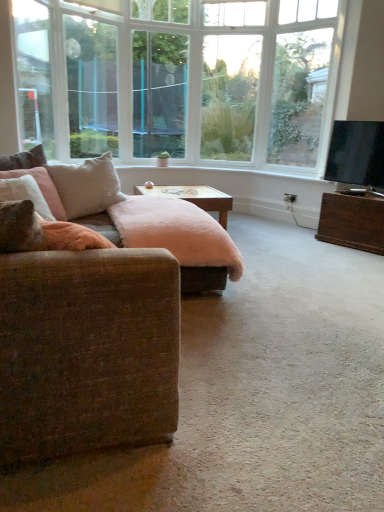
Question: Is clear glass window screen at center, marked as the 1th window screen in a right-to-left arrangement, bigger or smaller than clear glass window screen at upper left, the first window screen viewed from the left?

Choices:
 (A) big
 (B) small

Answer: (B)

Question: Relative to clear glass window screen at upper left, marked as the second window screen in a right-to-left arrangement, is clear glass window screen at center, marked as the 1th window screen in a right-to-left arrangement, in front or behind?

Choices:
 (A) behind
 (B) front

Answer: (A)

Question: Which object is the farthest from the woodenobject at center, the 2th table viewed from the right?

Choices:
 (A) white soft pillow at upper left, acting as the second pillow starting from the left
 (B) clear glass window screen at center, which ranks as the second window screen in left-to-right order
 (C) clear glass window screen at upper left, marked as the second window screen in a right-to-left arrangement
 (D) wooden coffee table at right, placed as the first table when sorted from right to left
 (E) velvet pink pillow at left, acting as the first pillow starting from the left

Answer: (B)

Question: Estimate the real-world distances between objects in this image. Which object is closer to the white soft pillow at upper left, the first pillow from the right?

Choices:
 (A) clear glass window screen at center, which ranks as the second window screen in left-to-right order
 (B) black glossy tv at right
 (C) velvet pink pillow at left, which is the second pillow in right-to-left order
 (D) clear glass window screen at upper left, marked as the second window screen in a right-to-left arrangement
 (E) fuzzy pink ottoman at center

Answer: (C)